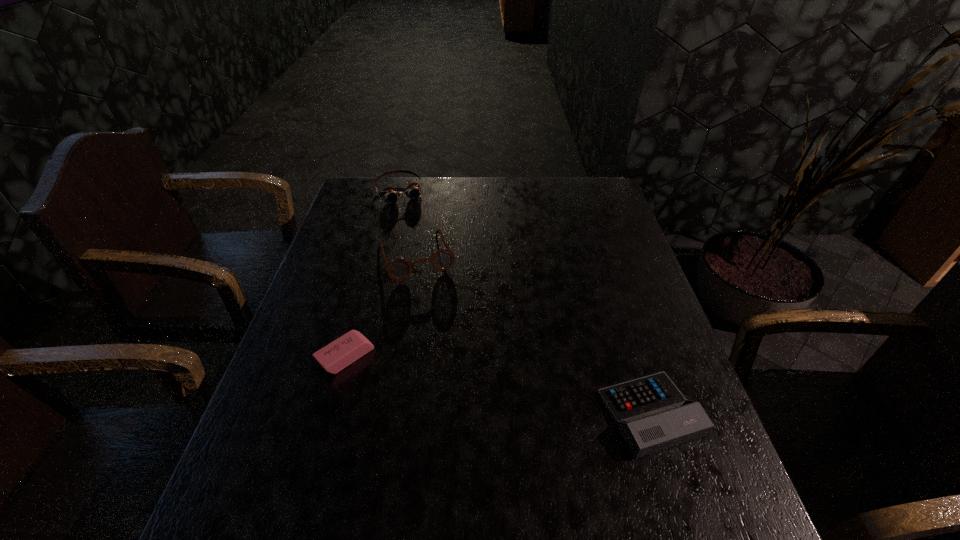
Where is `vacant space on the desktop that is between the eraser and the calculator and is positioned on the front-facing side of the spectacles`? Image resolution: width=960 pixels, height=540 pixels. vacant space on the desktop that is between the eraser and the calculator and is positioned on the front-facing side of the spectacles is located at coordinates (463, 379).

You are a GUI agent. You are given a task and a screenshot of the screen. Output one action in this format:
    pyautogui.click(x=<x>, y=<y>)
    Task: Click on the vacant space on the desktop that is between the eraser and the rightmost object and is positioned through the lenses of the third shortest object
    
    Given the screenshot: What is the action you would take?
    pyautogui.click(x=487, y=383)